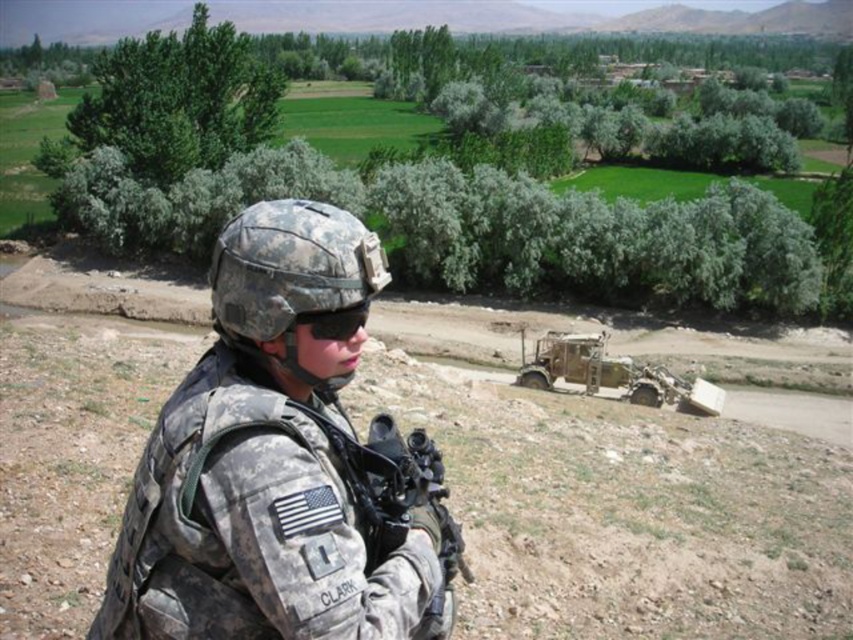
Is green leafy bush at upper left shorter than black matte goggles at center?

No.

Can you confirm if green leafy bush at upper left is positioned to the left of black matte goggles at center?

Indeed, green leafy bush at upper left is positioned on the left side of black matte goggles at center.

Between point (192, 109) and point (343, 314), which one is positioned behind?

Point (192, 109)

I want to click on green leafy bush at upper left, so click(x=178, y=99).

Does camouflage uniform at center lie in front of green leafy bush at upper left?

Yes, it is.

Based on the photo, can you confirm if camouflage uniform at center is positioned above green leafy bush at upper left?

Incorrect, camouflage uniform at center is not positioned above green leafy bush at upper left.

Which is in front, point (323, 435) or point (206, 60)?

Positioned in front is point (323, 435).

Where is `camouflage uniform at center`? This screenshot has width=853, height=640. camouflage uniform at center is located at coordinates (281, 465).

Does camouflage uniform at center lie in front of black matte goggles at center?

That is True.

Between point (151, 580) and point (300, 317), which one is positioned in front?

Positioned in front is point (151, 580).

Which is in front, point (296, 257) or point (361, 326)?

Point (296, 257) is in front.

Where is `camouflage uniform at center`? This screenshot has height=640, width=853. camouflage uniform at center is located at coordinates (281, 465).